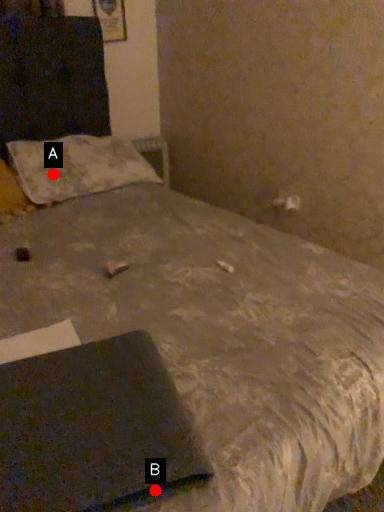
Question: Two points are circled on the image, labeled by A and B beside each circle. Which point is closer to the camera?

Choices:
 (A) A is closer
 (B) B is closer

Answer: (B)